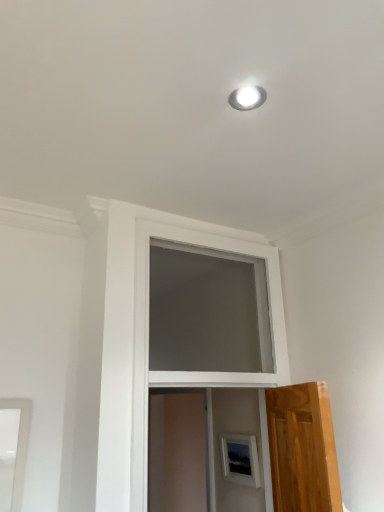
This screenshot has height=512, width=384. Find the location of `translucent wood screen door at center`. translucent wood screen door at center is located at coordinates (178, 451).

What do you see at coordinates (178, 451) in the screenshot? Image resolution: width=384 pixels, height=512 pixels. I see `translucent wood screen door at center` at bounding box center [178, 451].

Identify the location of white glossy light fixture at upper center. (247, 98).

Describe the element at coordinates (247, 98) in the screenshot. This screenshot has width=384, height=512. I see `white glossy light fixture at upper center` at that location.

This screenshot has height=512, width=384. Identify the location of translucent wood screen door at center. (178, 451).

Does translucent wood screen door at center appear on the right side of white glossy light fixture at upper center?

No, translucent wood screen door at center is not to the right of white glossy light fixture at upper center.

Is translucent wood screen door at center positioned in front of white glossy light fixture at upper center?

No, it is behind white glossy light fixture at upper center.

Is point (178, 445) farther from camera compared to point (240, 95)?

Yes.

From the image's perspective, between translucent wood screen door at center and white glossy light fixture at upper center, who is located below?

translucent wood screen door at center, from the image's perspective.

Looking at this image, from a real-world perspective, is translucent wood screen door at center physically below white glossy light fixture at upper center?

Yes, from a real-world perspective, translucent wood screen door at center is under white glossy light fixture at upper center.

Which object is thinner, translucent wood screen door at center or white glossy light fixture at upper center?

With smaller width is white glossy light fixture at upper center.

In terms of height, does translucent wood screen door at center look taller or shorter compared to white glossy light fixture at upper center?

Clearly, translucent wood screen door at center is taller compared to white glossy light fixture at upper center.

Based on the photo, who is bigger, translucent wood screen door at center or white glossy light fixture at upper center?

With larger size is translucent wood screen door at center.

Is translucent wood screen door at center surrounding white glossy light fixture at upper center?

No, white glossy light fixture at upper center is not inside translucent wood screen door at center.

In the scene shown: Is translucent wood screen door at center in contact with white glossy light fixture at upper center?

They are not placed beside each other.

Is translucent wood screen door at center aimed at white glossy light fixture at upper center?

No.

Measure the distance from translucent wood screen door at center to white glossy light fixture at upper center.

translucent wood screen door at center is 10.45 feet from white glossy light fixture at upper center.

Locate an element on the screen. screen door below the white glossy light fixture at upper center (from the image's perspective) is located at coordinates (178, 451).

Can you confirm if white glossy light fixture at upper center is positioned to the right of translucent wood screen door at center?

Yes.

Does white glossy light fixture at upper center come in front of translucent wood screen door at center?

Yes, white glossy light fixture at upper center is closer to the camera.

Is point (252, 105) positioned before point (187, 467)?

That is True.

From the image's perspective, is white glossy light fixture at upper center located above or below translucent wood screen door at center?

Based on their image positions, white glossy light fixture at upper center is located above translucent wood screen door at center.

From a real-world perspective, is white glossy light fixture at upper center positioned under translucent wood screen door at center based on gravity?

No, from a real-world perspective, white glossy light fixture at upper center is not below translucent wood screen door at center.

In terms of width, does white glossy light fixture at upper center look wider or thinner when compared to translucent wood screen door at center?

In the image, white glossy light fixture at upper center appears to be more narrow than translucent wood screen door at center.

From their relative heights in the image, would you say white glossy light fixture at upper center is taller or shorter than translucent wood screen door at center?

Clearly, white glossy light fixture at upper center is shorter compared to translucent wood screen door at center.

Who is smaller, white glossy light fixture at upper center or translucent wood screen door at center?

With smaller size is white glossy light fixture at upper center.

Does white glossy light fixture at upper center contain translucent wood screen door at center?

Actually, translucent wood screen door at center is outside white glossy light fixture at upper center.

Is there a large distance between white glossy light fixture at upper center and translucent wood screen door at center?

Absolutely, white glossy light fixture at upper center is distant from translucent wood screen door at center.

Is white glossy light fixture at upper center looking in the opposite direction of translucent wood screen door at center?

No, translucent wood screen door at center is not at the back of white glossy light fixture at upper center.

You are a GUI agent. You are given a task and a screenshot of the screen. Output one action in this format:
    pyautogui.click(x=<x>, y=<y>)
    Task: Click on the screen door below the white glossy light fixture at upper center (from the image's perspective)
    The height and width of the screenshot is (512, 384).
    Given the screenshot: What is the action you would take?
    pyautogui.click(x=178, y=451)

Locate an element on the screen. Image resolution: width=384 pixels, height=512 pixels. lighting on the right of translucent wood screen door at center is located at coordinates (247, 98).

At what (x,y) coordinates should I click in order to perform the action: click on lighting located in front of the translucent wood screen door at center. Please return your answer as a coordinate pair (x, y). This screenshot has height=512, width=384. Looking at the image, I should click on (247, 98).